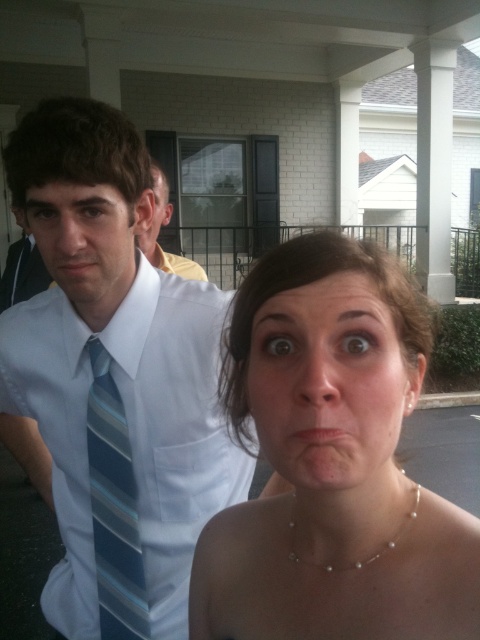
You are standing at the point labeled point (349, 528) in the image. You want to take a photo of the man in formal attire behind the woman in the foreground. Can you step back to get both the woman and the man in the frame without moving them? Explain your reasoning.

The point labeled point (349, 528) is 19.77 inches away from the viewer. Since the man is behind the woman, stepping back might allow both to be in the frame, but the distance needs to be sufficient to include both. However, without knowing the camera angle or focal length, it is uncertain. The given distance only specifies the viewer to point distance, not the depth between subjects.

From the picture: You are a photographer adjusting the camera settings to focus on the pearl necklace at center. Based on its position, which direction should you adjust the camera slightly to ensure it is centered in the frame?

The pearl necklace at center is already at the center point of the image, so no adjustment is needed.